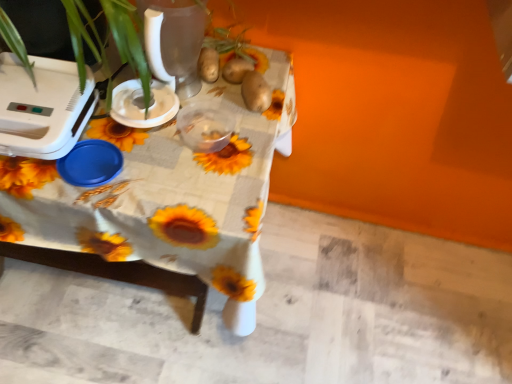
The image size is (512, 384). I want to click on vacant point to the right of sunflower-patterned fabric at center, so click(345, 292).